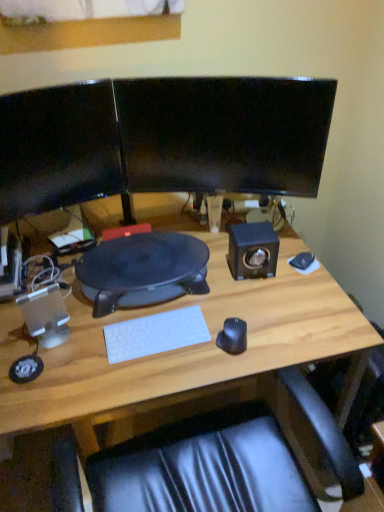
Locate an element on the screen. This screenshot has height=512, width=384. free area in between white matte keyboard at center and white matte mousepad at right is located at coordinates (234, 296).